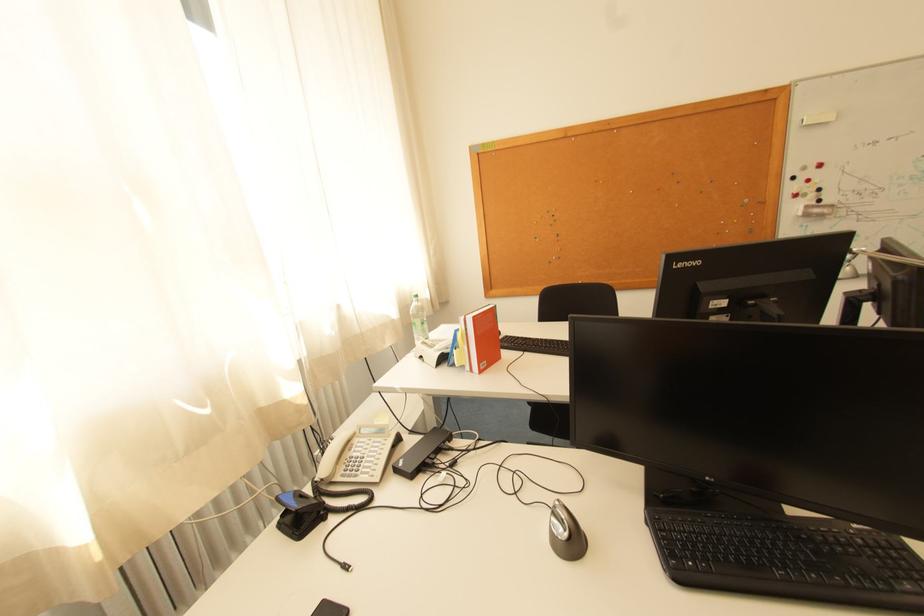
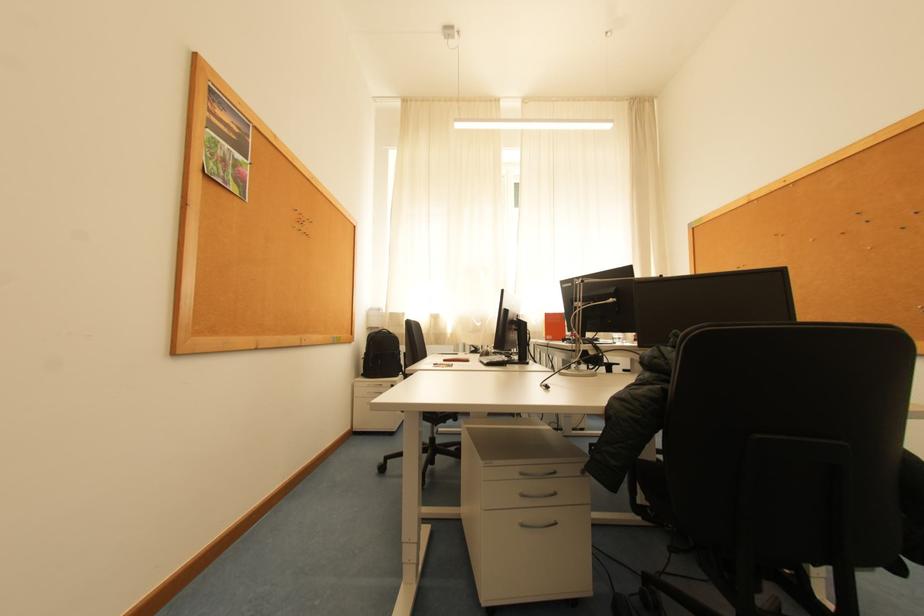
Question: I am providing you with two images of the same scene from different viewpoints. After the viewpoint changes to image2, which objects are now occluded?

Choices:
 (A) clear water bottle
 (B) black backpack
 (C) small pushpin
 (D) black plastic bucket

Answer: (A)